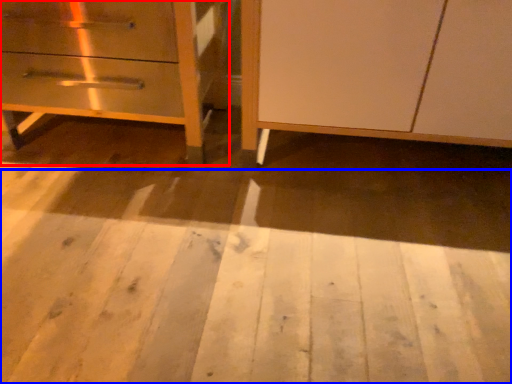
Question: Which of the following is the closest to the observer, chest of drawers (highlighted by a red box) or plywood (highlighted by a blue box)?

Choices:
 (A) chest of drawers
 (B) plywood

Answer: (B)